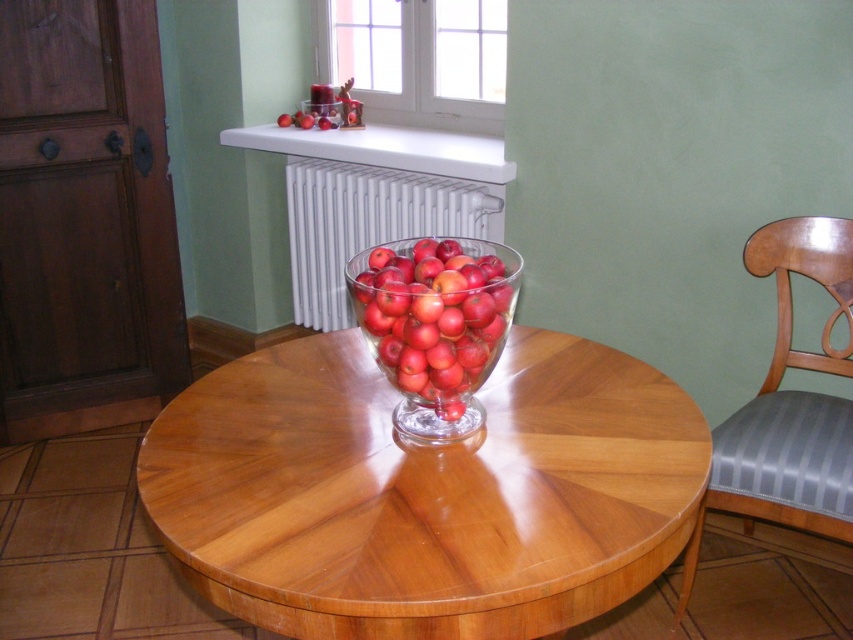
You are sitting at the round wooden table and want to get up to adjust the white metallic radiator at upper center. Is the wooden chair with striped cushion at right the closest chair to the radiator?

Yes, the wooden chair with striped cushion at right is positioned under the white metallic radiator at upper center, making it the closest chair to the radiator.

You are a painter standing in the room and want to place an easel that requires 1.8 meters of height. Based on the scene, can you use the space near the wooden chair with striped cushion at right and the white metallic radiator at upper center to set up your easel?

The wooden chair with striped cushion at right is taller than the white metallic radiator at upper center. Since the chair is taller, it indicates that the chair is at least 1.8 meters tall, so the easel can be placed near the wooden chair with striped cushion at right.